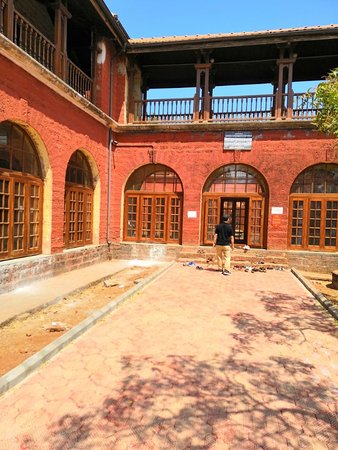
The image size is (338, 450). Identify the location of arched windows above doors. (324, 177), (284, 181), (132, 187), (74, 171), (11, 174).